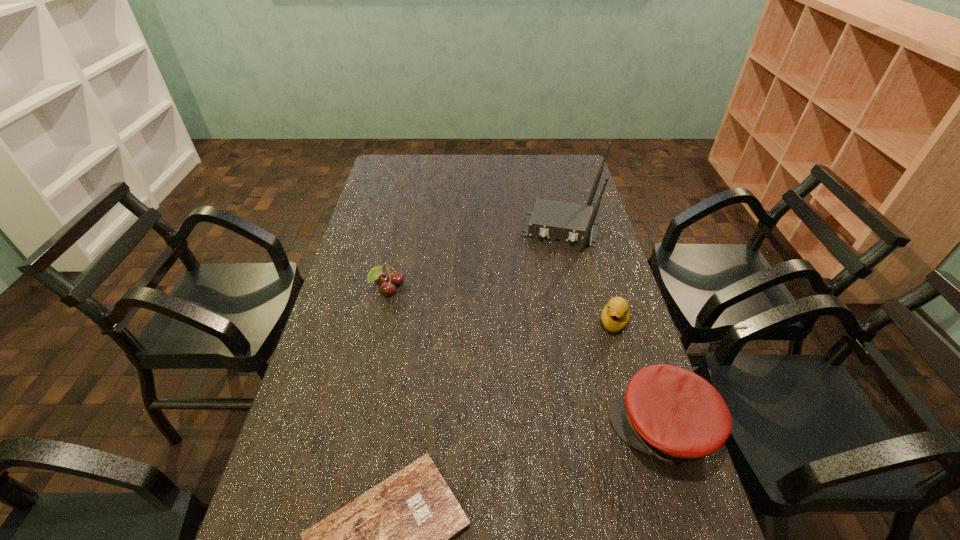
The width and height of the screenshot is (960, 540). In order to click on free space on the desktop that is between the Bible and the cap and is positioned on the back of the tallest object to connect cables in this screenshot , I will do `click(512, 485)`.

Locate an element on the screen. vacant space on the desktop that is between the Bible and the cap and is positioned on the leaves of the fourth nearest object is located at coordinates (543, 473).

Image resolution: width=960 pixels, height=540 pixels. In order to click on free space on the desktop that is between the Bible and the cap and is positioned on the face of the third farthest object in this screenshot , I will do `click(572, 463)`.